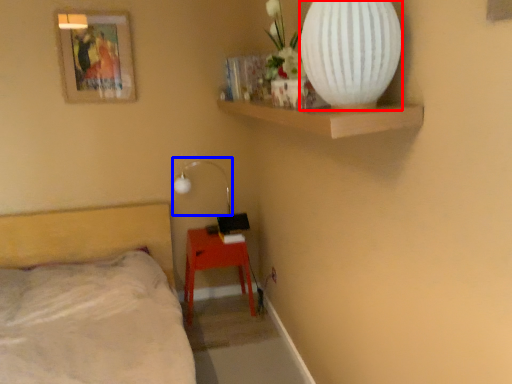
Question: Which point is further to the camera, vase (highlighted by a red box) or lamp (highlighted by a blue box)?

Choices:
 (A) vase
 (B) lamp

Answer: (B)